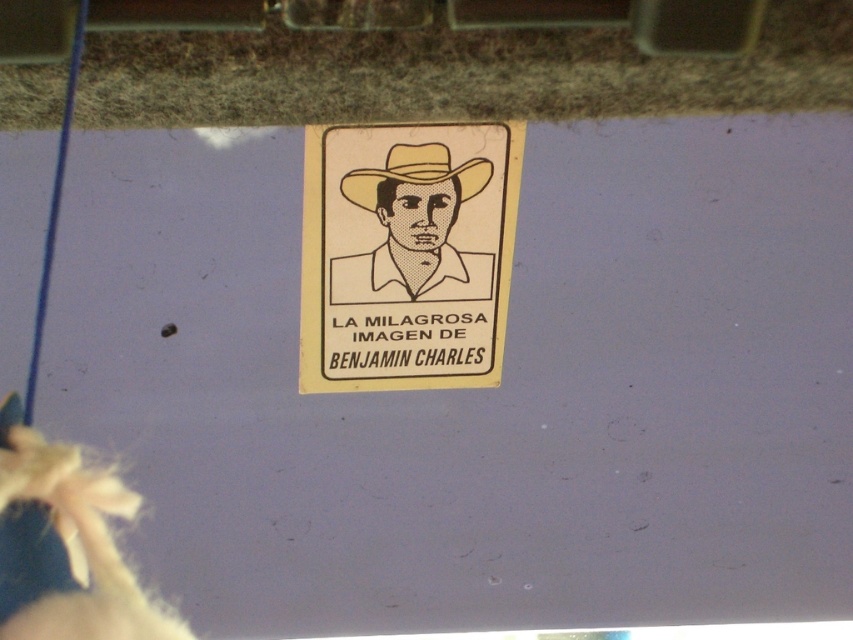
Is white paper sign at center positioned in front of beige paper sticker at center?

Yes, white paper sign at center is closer to the viewer.

Does white paper sign at center have a lesser height compared to beige paper sticker at center?

In fact, white paper sign at center may be taller than beige paper sticker at center.

Which is behind, point (444, 252) or point (419, 205)?

Point (444, 252)

Image resolution: width=853 pixels, height=640 pixels. Find the location of `white paper sign at center`. white paper sign at center is located at coordinates pos(405,253).

Is white paper sign at center to the right of beige paper cowboy hat at center from the viewer's perspective?

Incorrect, white paper sign at center is not on the right side of beige paper cowboy hat at center.

Between white paper sign at center and beige paper cowboy hat at center, which one is positioned lower?

white paper sign at center

Locate an element on the screen. The width and height of the screenshot is (853, 640). white paper sign at center is located at coordinates (405, 253).

Between point (442, 259) and point (430, 150), which one is positioned behind?

The point (442, 259) is more distant.

Is beige paper sticker at center taller than beige paper cowboy hat at center?

Correct, beige paper sticker at center is much taller as beige paper cowboy hat at center.

Which is in front, point (392, 211) or point (357, 168)?

Point (357, 168) is more forward.

The height and width of the screenshot is (640, 853). I want to click on beige paper sticker at center, so click(x=413, y=230).